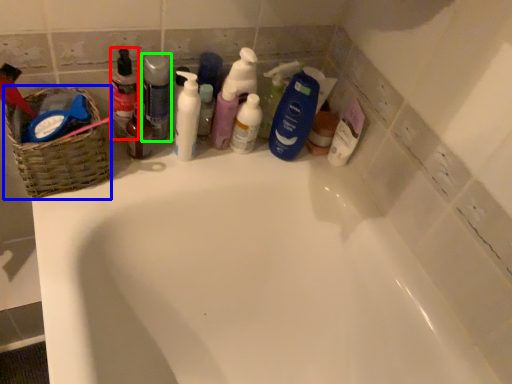
Question: Estimate the real-world distances between objects in this image. Which object is closer to toiletry (highlighted by a red box), basket (highlighted by a blue box) or cleaning product (highlighted by a green box)?

Choices:
 (A) basket
 (B) cleaning product

Answer: (B)